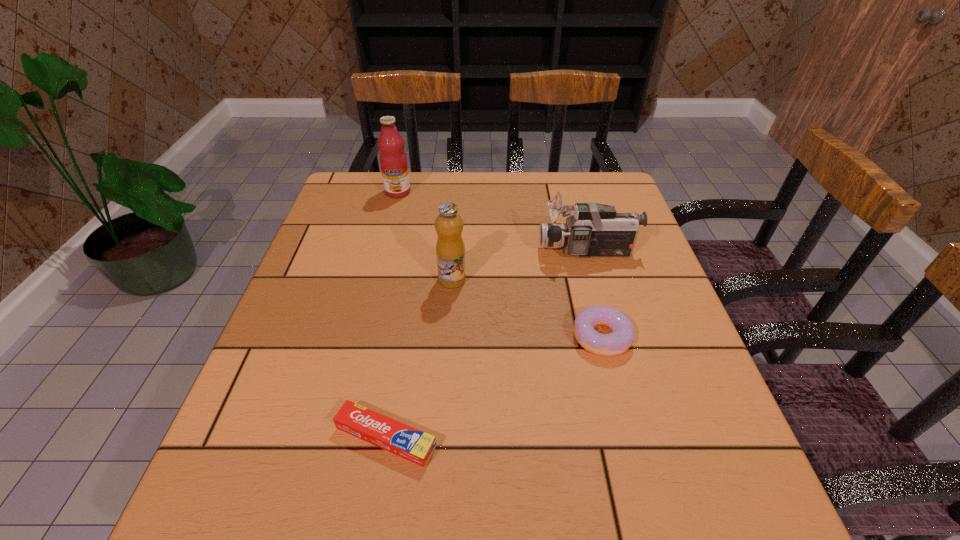
Where is `blank region between the nearer fruit juice and the nearest object`? blank region between the nearer fruit juice and the nearest object is located at coordinates (419, 359).

You are a GUI agent. You are given a task and a screenshot of the screen. Output one action in this format:
    pyautogui.click(x=<x>, y=<y>)
    Task: Click on the free space between the nearest object and the fourth nearest object
    
    Given the screenshot: What is the action you would take?
    pyautogui.click(x=487, y=344)

At what (x,y) coordinates should I click in order to perform the action: click on vacant space that is in between the shortest object and the fourth nearest object. Please return your answer as a coordinate pair (x, y). The width and height of the screenshot is (960, 540). Looking at the image, I should click on (487, 344).

You are a GUI agent. You are given a task and a screenshot of the screen. Output one action in this format:
    pyautogui.click(x=<x>, y=<y>)
    Task: Click on the vacant space in between the second farthest object and the toothpaste
    Image resolution: width=960 pixels, height=540 pixels.
    Given the screenshot: What is the action you would take?
    tap(487, 344)

Locate an element on the screen. This screenshot has width=960, height=540. free spot between the camcorder and the toothpaste is located at coordinates (487, 344).

Where is `vacant point located between the right fruit juice and the doughnut`? vacant point located between the right fruit juice and the doughnut is located at coordinates (527, 308).

The image size is (960, 540). Find the location of `empty location between the farthest object and the camcorder`. empty location between the farthest object and the camcorder is located at coordinates (492, 221).

The width and height of the screenshot is (960, 540). I want to click on unoccupied position between the third shortest object and the nearer fruit juice, so click(x=520, y=266).

The height and width of the screenshot is (540, 960). In order to click on the second closest object to the fourth nearest object in this screenshot , I will do `click(450, 250)`.

This screenshot has height=540, width=960. Identify the location of the third closest object relative to the second nearest object. (414, 445).